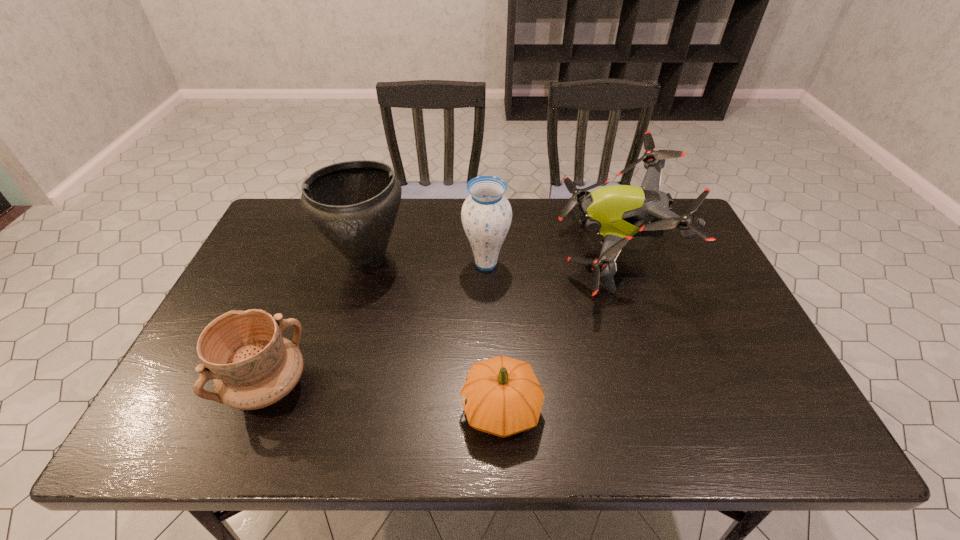
Identify the location of empty space that is in between the gourd and the vase. This screenshot has height=540, width=960. (493, 336).

Image resolution: width=960 pixels, height=540 pixels. In order to click on empty location between the gourd and the drone in this screenshot , I will do `click(557, 330)`.

Find the location of `vacant space in between the fourth tallest object and the shortest object`. vacant space in between the fourth tallest object and the shortest object is located at coordinates (385, 397).

Where is `free space between the fourth tallest object and the rightmost object`? This screenshot has width=960, height=540. free space between the fourth tallest object and the rightmost object is located at coordinates (441, 319).

At what (x,y) coordinates should I click in order to perform the action: click on free space between the rightmost object and the shortest object. Please return your answer as a coordinate pair (x, y). Looking at the image, I should click on (557, 330).

Locate an element on the screen. Image resolution: width=960 pixels, height=540 pixels. free space between the urn and the second shortest object is located at coordinates (318, 322).

Locate an element on the screen. The width and height of the screenshot is (960, 540). object that is the fourth closest to the urn is located at coordinates (617, 213).

I want to click on object that is the second closest to the shortest object, so click(x=486, y=215).

You are a GUI agent. You are given a task and a screenshot of the screen. Output one action in this format:
    pyautogui.click(x=<x>, y=<y>)
    Task: Click on the blank area in the image that satisfies the following two spatial constraints: 1. on the front-facing side of the rightmost object; 2. on the front side of the pottery
    Image resolution: width=960 pixels, height=540 pixels.
    Given the screenshot: What is the action you would take?
    pyautogui.click(x=658, y=386)

Where is `free spot that satisfies the following two spatial constraints: 1. on the front-facing side of the drone; 2. on the front side of the urn`? The height and width of the screenshot is (540, 960). free spot that satisfies the following two spatial constraints: 1. on the front-facing side of the drone; 2. on the front side of the urn is located at coordinates (615, 258).